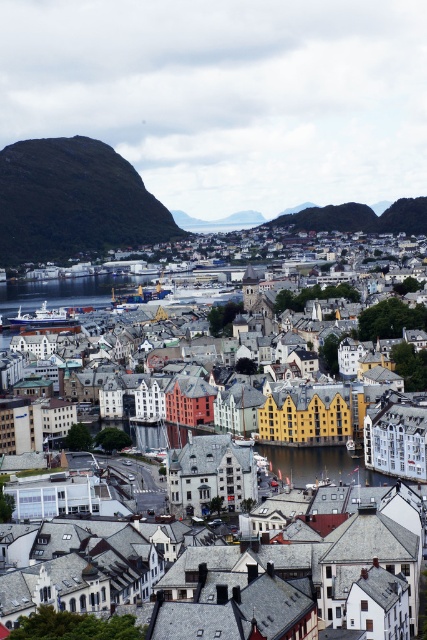
You are standing in the coastal town and want to take a photo of both the dark gray rocky mountain at left and the transparent water at center. Which object should you focus on first to ensure both are in the frame?

You should focus on the dark gray rocky mountain at left first because it is closer to you than the transparent water at center, so by focusing on it, the transparent water at center will naturally be in the background and still in the frame.

You are a tourist standing at the edge of the town facing the water. You want to take a photo that includes both the yellow matte building at center and the transparent water at center. Which object should you position closer to the edge of your camera frame to ensure both are fully visible?

Since the yellow matte building at center might be wider than the transparent water at center, you should position the yellow matte building at center closer to the edge of your camera frame. This way, the wider building will occupy more space, allowing the narrower transparent water to fit within the frame as well.